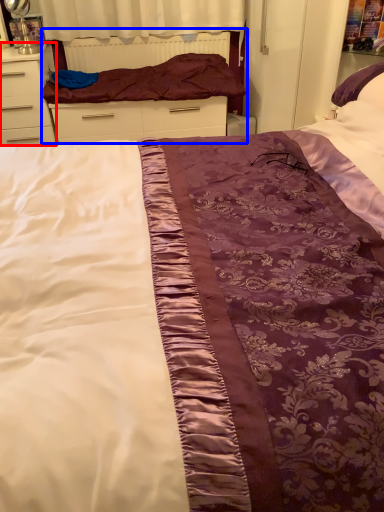
Question: Which object appears farthest to the camera in this image, chest of drawers (highlighted by a red box) or bed frame (highlighted by a blue box)?

Choices:
 (A) chest of drawers
 (B) bed frame

Answer: (B)